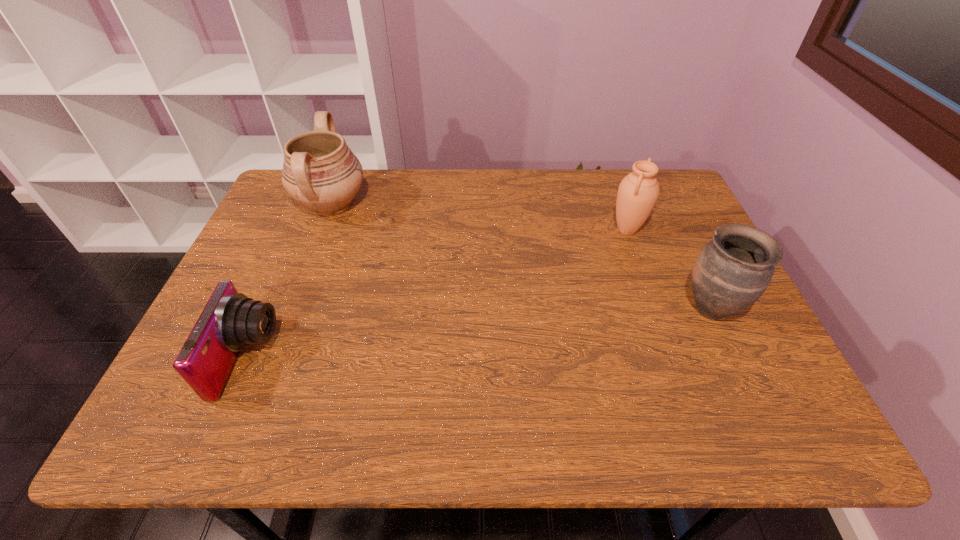
Where is `the leftmost urn`? Image resolution: width=960 pixels, height=540 pixels. the leftmost urn is located at coordinates (320, 172).

I want to click on the rightmost urn, so click(x=733, y=270).

The width and height of the screenshot is (960, 540). In order to click on the rightmost object in this screenshot , I will do `click(733, 270)`.

At what (x,y) coordinates should I click in order to perform the action: click on the second object from right to left. Please return your answer as a coordinate pair (x, y). Looking at the image, I should click on (638, 192).

What are the coordinates of `camera` in the screenshot? It's located at (230, 321).

Find the location of a particular element. This screenshot has height=540, width=960. free location located on the front-facing side of the leftmost urn is located at coordinates (408, 205).

You are a GUI agent. You are given a task and a screenshot of the screen. Output one action in this format:
    pyautogui.click(x=<x>, y=<y>)
    Task: Click on the vacant position located 0.070m on the back of the nearest urn
    This screenshot has width=960, height=540.
    Given the screenshot: What is the action you would take?
    pyautogui.click(x=690, y=266)

In order to click on free region located 0.400m on the left of the second urn from left to right in this screenshot , I will do `click(468, 230)`.

Locate an element on the screen. vacant area situated on the front-facing side of the shortest object is located at coordinates (355, 359).

Where is `object that is at the far edge`? Image resolution: width=960 pixels, height=540 pixels. object that is at the far edge is located at coordinates (320, 172).